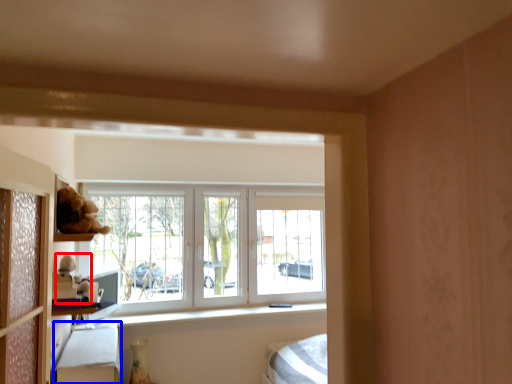
Question: Which of the following is the closest to the observer, toy (highlighted by a red box) or bed frame (highlighted by a blue box)?

Choices:
 (A) toy
 (B) bed frame

Answer: (B)